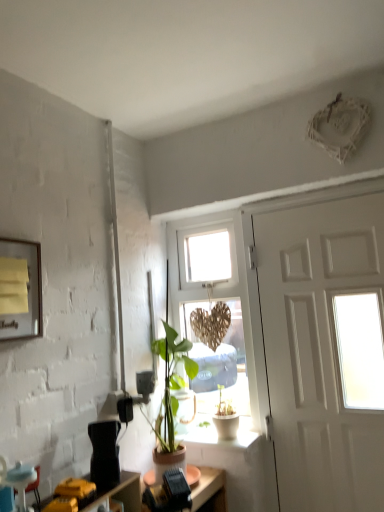
Question: Is white matte door at right situated inside blue fabric armchair at lower left or outside?

Choices:
 (A) outside
 (B) inside

Answer: (A)

Question: From the image's perspective, relative to blue fabric armchair at lower left, is white matte door at right above or below?

Choices:
 (A) above
 (B) below

Answer: (A)

Question: Which of these objects is positioned farthest from the white matte door at right?

Choices:
 (A) black plastic desk at lower center
 (B) blue fabric armchair at lower left
 (C) yellow paper at upper left
 (D) white ceramic pot at lower center
 (E) wooden heart at center

Answer: (B)

Question: Which object is positioned farthest from the white matte door at right?

Choices:
 (A) wooden heart at center
 (B) blue fabric armchair at lower left
 (C) black plastic desk at lower center
 (D) yellow paper at upper left
 (E) white ceramic pot at lower center

Answer: (B)